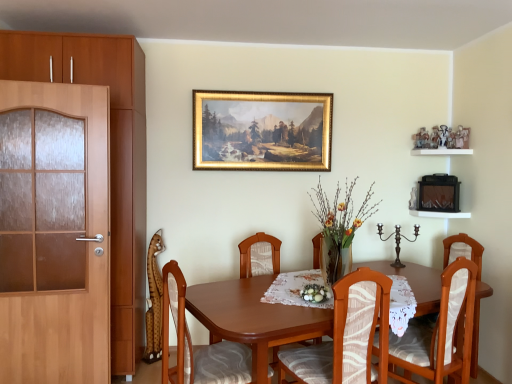
The width and height of the screenshot is (512, 384). Find the location of `wooden chair with patterned cushion at center, which is counted as the first chair, starting from the left`. wooden chair with patterned cushion at center, which is counted as the first chair, starting from the left is located at coordinates (199, 348).

Where is `wooden chair with patterned cushion at center, the 3th chair in the right-to-left sequence`? Image resolution: width=512 pixels, height=384 pixels. wooden chair with patterned cushion at center, the 3th chair in the right-to-left sequence is located at coordinates (259, 255).

Describe the element at coordinates (259, 255) in the screenshot. This screenshot has height=384, width=512. I see `wooden chair with patterned cushion at center, the 3th chair in the right-to-left sequence` at that location.

Describe the element at coordinates (347, 336) in the screenshot. I see `wooden chair with patterned cushion at center, placed as the 2th chair when sorted from right to left` at that location.

Find the location of a particular element. The height and width of the screenshot is (384, 512). translucent glass vase at center, the second floral arrangement in the bottom-to-top sequence is located at coordinates (340, 223).

This screenshot has height=384, width=512. Find the location of `matte wood cabinet at left`. matte wood cabinet at left is located at coordinates (111, 156).

The height and width of the screenshot is (384, 512). What are the coordinates of `wooden chair with patterned cushion at center, which is counted as the first chair, starting from the left` in the screenshot? It's located at (199, 348).

Who is more distant, matte wood cabinet at left or white lace tablecloth at center?

matte wood cabinet at left is further from the camera.

Considering the relative sizes of matte wood cabinet at left and white lace tablecloth at center in the image provided, is matte wood cabinet at left bigger than white lace tablecloth at center?

Yes.

Do you think matte wood cabinet at left is within white lace tablecloth at center, or outside of it?

matte wood cabinet at left cannot be found inside white lace tablecloth at center.

Is matte wood cabinet at left not near white lace tablecloth at center?

matte wood cabinet at left is far away from white lace tablecloth at center.

From a real-world perspective, between matte wood cabinet at left and wooden chair with patterned cushion at center, the 3th chair in the right-to-left sequence, who is vertically higher?

From a 3D spatial view, matte wood cabinet at left is above.

This screenshot has height=384, width=512. I want to click on cabinetry above the wooden chair with patterned cushion at center, the 3th chair in the right-to-left sequence (from a real-world perspective), so click(x=111, y=156).

The width and height of the screenshot is (512, 384). In order to click on floral arrangement on the right of white fabric floral arrangement at center, the 1th floral arrangement in the bottom-to-top sequence in this screenshot , I will do `click(340, 223)`.

Consider the image. Between white fabric floral arrangement at center, which is the 2th floral arrangement from top to bottom, and translucent glass vase at center, arranged as the first floral arrangement when viewed from the top, which one appears on the left side from the viewer's perspective?

Positioned to the left is white fabric floral arrangement at center, which is the 2th floral arrangement from top to bottom.

Can you confirm if white fabric floral arrangement at center, the 1th floral arrangement in the bottom-to-top sequence, is thinner than translucent glass vase at center, the second floral arrangement in the bottom-to-top sequence?

Yes, white fabric floral arrangement at center, the 1th floral arrangement in the bottom-to-top sequence, is thinner than translucent glass vase at center, the second floral arrangement in the bottom-to-top sequence.

Looking at this image, which point is more forward, (x=307, y=343) or (x=324, y=292)?

The point (x=307, y=343) is more forward.

Locate an element on the screen. The width and height of the screenshot is (512, 384). the 3rd chair below the white fabric floral arrangement at center, the 1th floral arrangement in the bottom-to-top sequence (from the image's perspective) is located at coordinates (259, 255).

Considering the positions of objects wooden chair with patterned cushion at center, the 2th chair from the left, and white fabric floral arrangement at center, which is the 2th floral arrangement from top to bottom, in the image provided, who is behind, wooden chair with patterned cushion at center, the 2th chair from the left, or white fabric floral arrangement at center, which is the 2th floral arrangement from top to bottom,?

wooden chair with patterned cushion at center, the 2th chair from the left, is further away from the camera.

Which object is thinner, wooden chair with patterned cushion at center, the 2th chair from the left, or white fabric floral arrangement at center, which is the 2th floral arrangement from top to bottom?

Thinner between the two is white fabric floral arrangement at center, which is the 2th floral arrangement from top to bottom.

Is gold-framed painting at upper center closer to camera compared to white wooden shelf at upper right?

No, gold-framed painting at upper center is behind white wooden shelf at upper right.

Does point (223, 134) appear closer or farther from the camera than point (449, 154)?

Clearly, point (223, 134) is more distant from the camera than point (449, 154).

Is white wooden shelf at upper right surrounded by gold-framed painting at upper center?

No, white wooden shelf at upper right is not inside gold-framed painting at upper center.

How different are the orientations of gold-framed painting at upper center and white wooden shelf at upper right in degrees?

gold-framed painting at upper center and white wooden shelf at upper right are facing 90.6 degrees away from each other.

Is white wooden shelf at upper right facing towards white lace tablecloth at center?

No.

Is white wooden shelf at upper right spatially inside white lace tablecloth at center, or outside of it?

white wooden shelf at upper right is not enclosed by white lace tablecloth at center.

Can you confirm if white wooden shelf at upper right is wider than white lace tablecloth at center?

No.

Can you confirm if wooden chair with patterned cushion at center, the 2th chair from the left, is shorter than white wooden shelf at upper right?

No.

From the image's perspective, count 3rd chairs downward from the white wooden shelf at upper right and point to it. Please provide its 2D coordinates.

[(259, 255)]

How many degrees apart are the facing directions of wooden chair with patterned cushion at center, the 3th chair in the right-to-left sequence, and white wooden shelf at upper right?

The angle between the facing direction of wooden chair with patterned cushion at center, the 3th chair in the right-to-left sequence, and the facing direction of white wooden shelf at upper right is 110 degrees.

From the image's perspective, which object appears higher, wooden chair with patterned cushion at center, the 3th chair in the right-to-left sequence, or white wooden shelf at upper right?

white wooden shelf at upper right appears higher in the image.

Where is `tablecloth located underneath the matte wood cabinet at left (from a real-world perspective)`? The height and width of the screenshot is (384, 512). tablecloth located underneath the matte wood cabinet at left (from a real-world perspective) is located at coordinates [x=295, y=289].

This screenshot has height=384, width=512. I want to click on cabinetry to the left of wooden chair with patterned cushion at center, the 2th chair from the left, so click(x=111, y=156).

Considering their positions, is wooden chair with patterned cushion at center, placed as the fourth chair when sorted from right to left, positioned closer to white fabric floral arrangement at center, which is the 2th floral arrangement from top to bottom, than wooden chair with patterned cushion at center, marked as the 3th chair in a left-to-right arrangement?

wooden chair with patterned cushion at center, marked as the 3th chair in a left-to-right arrangement.

Considering their positions, is wooden chair with white cushion at center, the 4th chair in the left-to-right sequence, positioned closer to white lace tablecloth at center than wooden chair with patterned cushion at center, placed as the fourth chair when sorted from right to left?

wooden chair with patterned cushion at center, placed as the fourth chair when sorted from right to left, is positioned closer to the anchor white lace tablecloth at center.

From the image, which object appears to be nearer to white lace tablecloth at center, translucent glass vase at center, the second floral arrangement in the bottom-to-top sequence, or white fabric floral arrangement at center, the 1th floral arrangement in the bottom-to-top sequence?

The object closer to white lace tablecloth at center is white fabric floral arrangement at center, the 1th floral arrangement in the bottom-to-top sequence.

Considering their positions, is wooden chair with patterned cushion at center, the 3th chair in the right-to-left sequence, positioned further to translucent glass vase at center, arranged as the first floral arrangement when viewed from the top, than wooden chair with patterned cushion at center, placed as the fourth chair when sorted from right to left?

Among the two, wooden chair with patterned cushion at center, placed as the fourth chair when sorted from right to left, is located further to translucent glass vase at center, arranged as the first floral arrangement when viewed from the top.

Based on their spatial positions, is wooden chair with white cushion at center, the first chair when ordered from right to left, or translucent glass vase at center, the second floral arrangement in the bottom-to-top sequence, further from gold-framed painting at upper center?

wooden chair with white cushion at center, the first chair when ordered from right to left, is positioned further to the anchor gold-framed painting at upper center.

Looking at the image, which one is located closer to wooden chair with patterned cushion at center, placed as the 2th chair when sorted from right to left, white lace tablecloth at center or white wooden shelf at upper right?

white lace tablecloth at center is positioned closer to the anchor wooden chair with patterned cushion at center, placed as the 2th chair when sorted from right to left.

Which object lies nearer to the anchor point wooden chair with patterned cushion at center, the 2th chair from the left, wooden chair with patterned cushion at center, placed as the 2th chair when sorted from right to left, or white wooden shelf at upper right?

wooden chair with patterned cushion at center, placed as the 2th chair when sorted from right to left.

Which object lies nearer to the anchor point translucent glass vase at center, arranged as the first floral arrangement when viewed from the top, matte wood cabinet at left or gold-framed painting at upper center?

gold-framed painting at upper center is closer to translucent glass vase at center, arranged as the first floral arrangement when viewed from the top.

Identify the location of tablecloth that lies between translucent glass vase at center, arranged as the first floral arrangement when viewed from the top, and wooden chair with white cushion at center, the first chair when ordered from right to left, from top to bottom. pos(295,289).

Locate an element on the screen. This screenshot has width=512, height=384. tablecloth located between wooden chair with patterned cushion at center, placed as the fourth chair when sorted from right to left, and gold-framed painting at upper center in the depth direction is located at coordinates (295, 289).

Image resolution: width=512 pixels, height=384 pixels. Find the location of `floral arrangement between wooden chair with patterned cushion at center, which is counted as the first chair, starting from the left, and wooden chair with patterned cushion at center, marked as the 3th chair in a left-to-right arrangement, from left to right`. floral arrangement between wooden chair with patterned cushion at center, which is counted as the first chair, starting from the left, and wooden chair with patterned cushion at center, marked as the 3th chair in a left-to-right arrangement, from left to right is located at coordinates (315, 293).

Locate an element on the screen. chair situated between white fabric floral arrangement at center, the 1th floral arrangement in the bottom-to-top sequence, and wooden chair with white cushion at center, the first chair when ordered from right to left, from left to right is located at coordinates (347, 336).